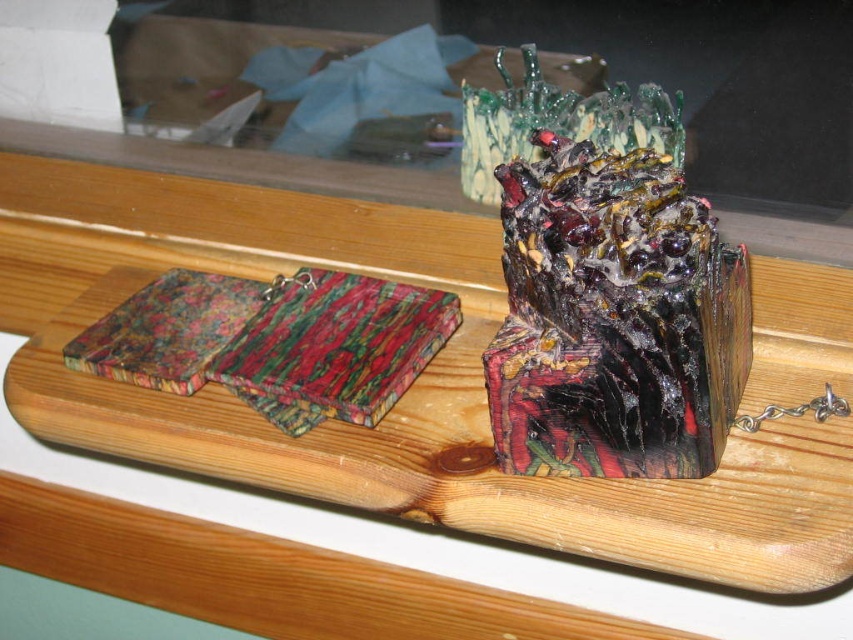
Based on the photo, you are placing a new vase on the wooden surface. The vase needs to be placed exactly at the center of the wooden surface. Is the wooden tray at center already occupying that spot?

The wooden tray at center is located at point (467, 461), which is not the exact center of the wooden surface. Therefore, the center of the wooden surface is still available for placing the new vase.

You are organizing a small party and need to place a decorative item on a table. You have a wooden tray at center and a glossy resin cube at center. Which object has a greater width and can accommodate more items?

The wooden tray at center has a greater width than the glossy resin cube at center, so it can accommodate more items.

You are organizing a display on a shelf and have to stack the glossy resin cube at center and the multicolored resin at center. Which object should you place at the bottom to ensure stability?

The glossy resin cube at center should be placed at the bottom because it has a greater height than the multicolored resin at center, providing a more stable base.